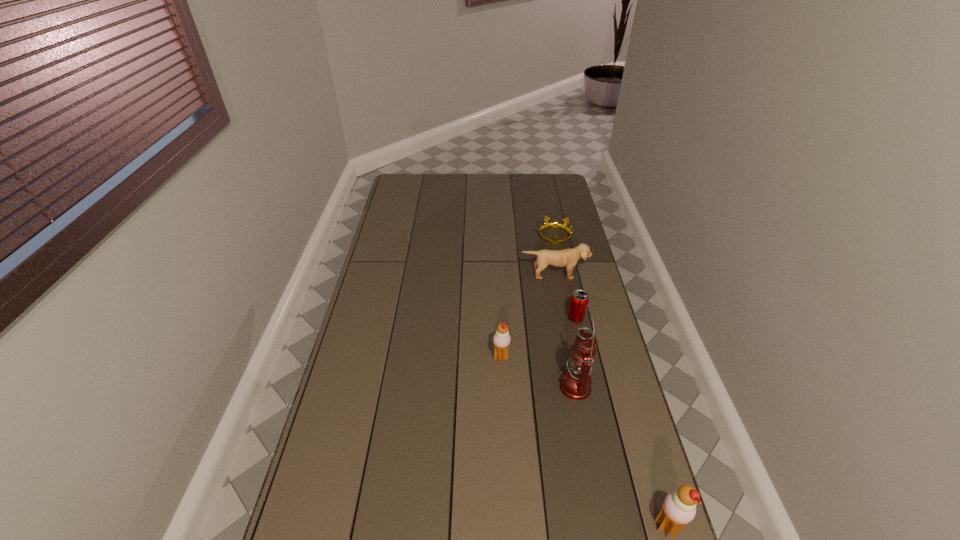
Locate an element on the screen. unoccupied position between the crown and the leftmost object is located at coordinates (528, 297).

I want to click on empty space that is in between the tallest object and the second farthest object, so click(x=564, y=330).

Locate which object is the third closest to the third farthest object. Please provide its 2D coordinates. Your answer should be formatted as a tuple, i.e. [(x, y)], where the tuple contains the x and y coordinates of a point satisfying the conditions above.

[(501, 340)]

Locate which object is the fourth closest to the farthest object. Please provide its 2D coordinates. Your answer should be formatted as a tuple, i.e. [(x, y)], where the tuple contains the x and y coordinates of a point satisfying the conditions above.

[(575, 384)]

Locate an element on the screen. This screenshot has width=960, height=540. blank space that satisfies the following two spatial constraints: 1. on the back side of the second nearest object; 2. on the left side of the shortest object is located at coordinates pyautogui.click(x=546, y=236).

This screenshot has width=960, height=540. What are the coordinates of `vacant space that satisfies the following two spatial constraints: 1. on the left side of the puppy; 2. at the front with a straw on the farther icecream` in the screenshot? It's located at (571, 357).